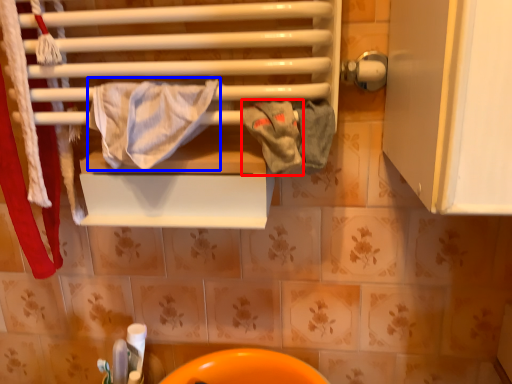
Question: Which point is further to the camera, bath towel (highlighted by a red box) or bath towel (highlighted by a blue box)?

Choices:
 (A) bath towel
 (B) bath towel

Answer: (A)